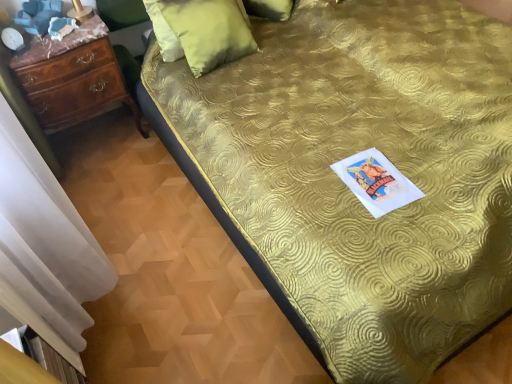
This screenshot has width=512, height=384. In order to click on spots to the right of mahogany wood chest of drawers at left in this screenshot , I will do `click(149, 158)`.